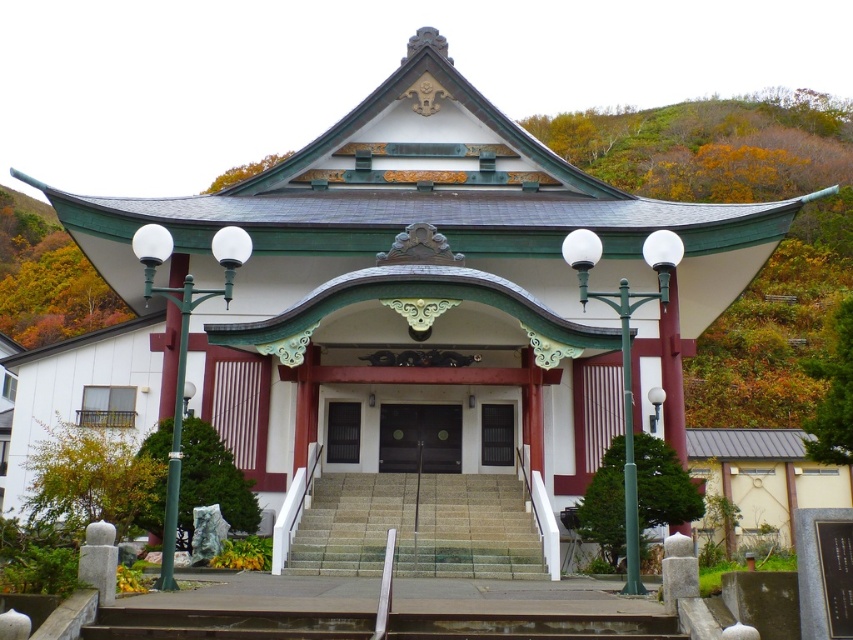
Question: Which point is farther to the camera?

Choices:
 (A) (331, 413)
 (B) (495, 417)
 (C) (339, 573)
 (D) (430, 406)

Answer: (D)

Question: Does smooth concrete stairs at center appear over matte glass door at center?

Choices:
 (A) yes
 (B) no

Answer: (B)

Question: Which point is closer to the camera?

Choices:
 (A) smooth concrete stairs at center
 (B) matte black door at center
 (C) matte glass door at center
 (D) black glossy door at center

Answer: (A)

Question: Based on their relative distances, which object is farther from the black glossy door at center?

Choices:
 (A) matte black door at center
 (B) smooth concrete stairs at center

Answer: (B)

Question: In this image, where is smooth concrete stairs at center located relative to black glossy door at center?

Choices:
 (A) right
 (B) left

Answer: (A)

Question: Can you confirm if smooth concrete stairs at center is positioned above matte black door at center?

Choices:
 (A) yes
 (B) no

Answer: (B)